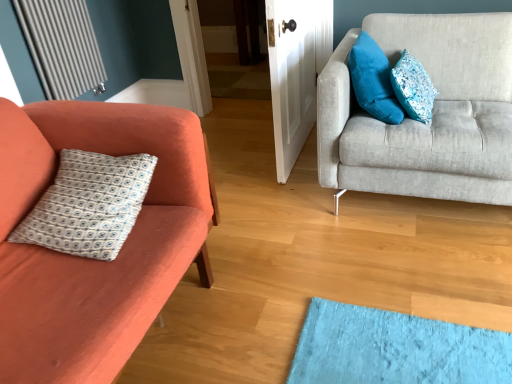
Question: Is white printed fabric pillow at left, acting as the third pillow starting from the right, taller than metallic silver radiator at upper left?

Choices:
 (A) yes
 (B) no

Answer: (B)

Question: Is white printed fabric pillow at left, the first pillow in the left-to-right sequence, wider than metallic silver radiator at upper left?

Choices:
 (A) yes
 (B) no

Answer: (A)

Question: Considering the relative positions of white printed fabric pillow at left, acting as the third pillow starting from the right, and metallic silver radiator at upper left in the image provided, is white printed fabric pillow at left, acting as the third pillow starting from the right, to the right of metallic silver radiator at upper left from the viewer's perspective?

Choices:
 (A) no
 (B) yes

Answer: (B)

Question: Considering the relative sizes of white printed fabric pillow at left, acting as the third pillow starting from the right, and metallic silver radiator at upper left in the image provided, is white printed fabric pillow at left, acting as the third pillow starting from the right, smaller than metallic silver radiator at upper left?

Choices:
 (A) yes
 (B) no

Answer: (B)

Question: Is metallic silver radiator at upper left completely or partially inside white printed fabric pillow at left, the first pillow in the left-to-right sequence?

Choices:
 (A) no
 (B) yes

Answer: (A)

Question: From a real-world perspective, does white printed fabric pillow at left, the first pillow in the left-to-right sequence, stand above metallic silver radiator at upper left?

Choices:
 (A) yes
 (B) no

Answer: (B)

Question: Does light gray fabric couch at right, acting as the first studio couch starting from the right, have a lesser height compared to velvety blue pillow at upper right, which ranks as the second pillow in right-to-left order?

Choices:
 (A) no
 (B) yes

Answer: (A)

Question: Can you confirm if light gray fabric couch at right, acting as the first studio couch starting from the right, is taller than velvety blue pillow at upper right, which is counted as the 2th pillow, starting from the left?

Choices:
 (A) yes
 (B) no

Answer: (A)

Question: Are light gray fabric couch at right, which appears as the second studio couch when viewed from the left, and velvety blue pillow at upper right, which is counted as the 2th pillow, starting from the left, far apart?

Choices:
 (A) no
 (B) yes

Answer: (A)

Question: From the image's perspective, would you say light gray fabric couch at right, which appears as the second studio couch when viewed from the left, is positioned over velvety blue pillow at upper right, which ranks as the second pillow in right-to-left order?

Choices:
 (A) yes
 (B) no

Answer: (B)

Question: Does light gray fabric couch at right, acting as the first studio couch starting from the right, have a larger size compared to velvety blue pillow at upper right, which ranks as the second pillow in right-to-left order?

Choices:
 (A) no
 (B) yes

Answer: (B)

Question: From a real-world perspective, is light gray fabric couch at right, acting as the first studio couch starting from the right, located higher than velvety blue pillow at upper right, which ranks as the second pillow in right-to-left order?

Choices:
 (A) yes
 (B) no

Answer: (B)

Question: Can you confirm if matte orange couch at left, arranged as the 1th studio couch when viewed from the left, is thinner than velvety blue pillow at upper right, which ranks as the second pillow in right-to-left order?

Choices:
 (A) no
 (B) yes

Answer: (A)